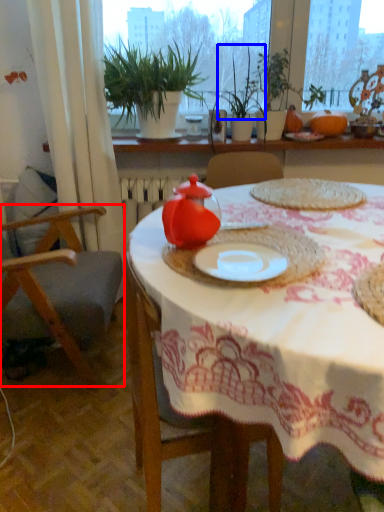
Question: Among these objects, which one is farthest to the camera, chair (highlighted by a red box) or plant (highlighted by a blue box)?

Choices:
 (A) chair
 (B) plant

Answer: (B)